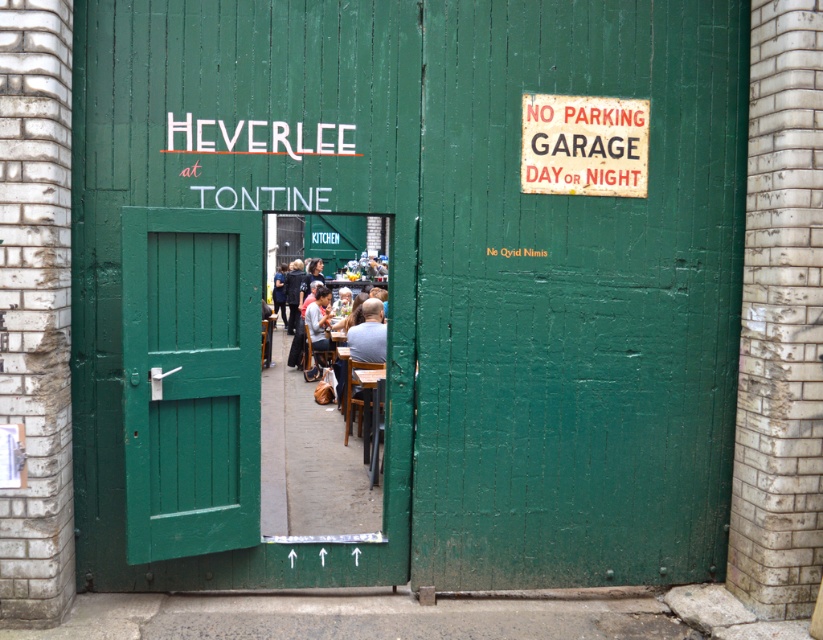
Question: From the image, what is the correct spatial relationship of green wooden door at center in relation to metallic rectangular sign at upper right?

Choices:
 (A) above
 (B) below

Answer: (B)

Question: Which of the following is the closest to the observer?

Choices:
 (A) green wooden door at center
 (B) metallic rectangular sign at upper right

Answer: (A)

Question: Is green wooden door at center to the right of metallic rectangular sign at upper right from the viewer's perspective?

Choices:
 (A) no
 (B) yes

Answer: (A)

Question: Does green wooden door at center appear on the right side of metallic rectangular sign at upper right?

Choices:
 (A) no
 (B) yes

Answer: (A)